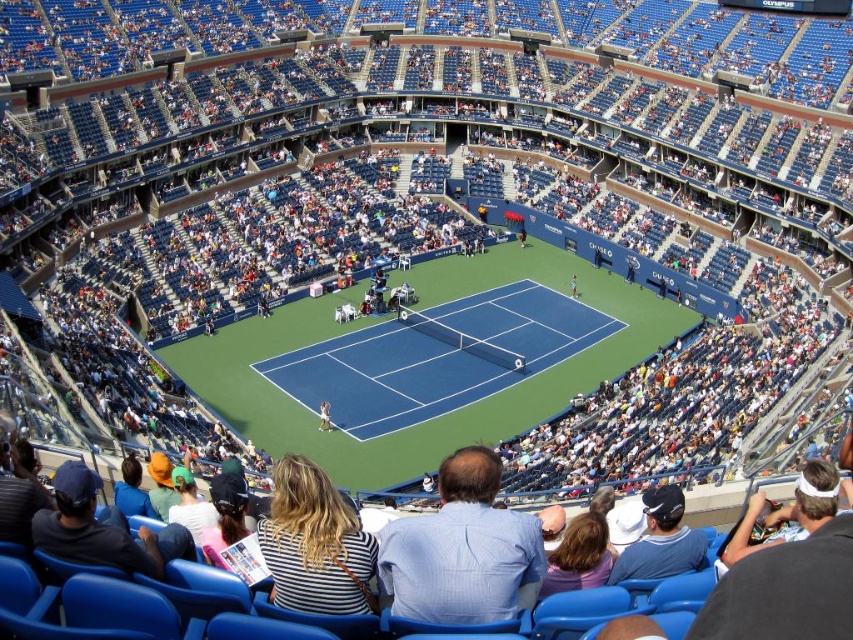
Question: Which object appears closest to the camera in this image?

Choices:
 (A) blue striped shirt at center
 (B) denim jacket at lower right
 (C) striped fabric shirt at lower center
 (D) orange cotton cap at lower left

Answer: (A)

Question: Which object appears closest to the camera in this image?

Choices:
 (A) denim jacket at lower right
 (B) striped shirt at center
 (C) white fabric tennis racket at center

Answer: (B)

Question: Is denim jacket at lower right wider than orange cotton cap at lower left?

Choices:
 (A) no
 (B) yes

Answer: (B)

Question: Which of these objects is positioned farthest from the white fabric tennis racket at center?

Choices:
 (A) white cotton shirt at lower left
 (B) striped shirt at center
 (C) orange cotton cap at lower left
 (D) striped fabric shirt at lower center

Answer: (B)

Question: From the image, what is the correct spatial relationship of orange cotton cap at lower left in relation to white fabric tennis racket at center?

Choices:
 (A) below
 (B) above

Answer: (A)

Question: Observing the image, what is the correct spatial positioning of white cotton shirt at lower left in reference to orange cotton cap at lower left?

Choices:
 (A) below
 (B) above

Answer: (A)